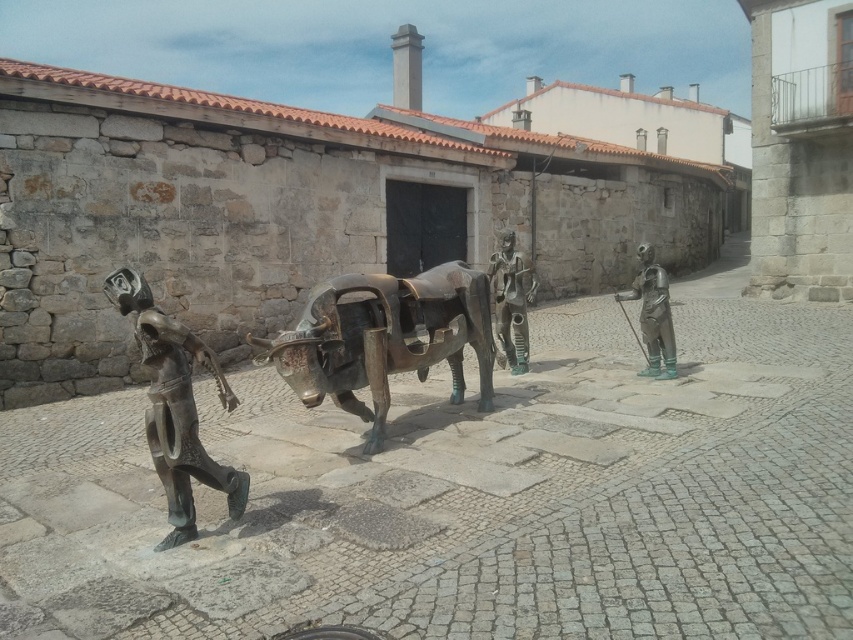
Question: Is bronze figure at left bigger than bronze statue at center?

Choices:
 (A) no
 (B) yes

Answer: (B)

Question: Which is farther from the green patina statue at right?

Choices:
 (A) bronze statue at center
 (B) bronze figure at left

Answer: (B)

Question: Is bronze statue at center further to the viewer compared to green patina statue at right?

Choices:
 (A) yes
 (B) no

Answer: (A)

Question: Where is bronze figure at left located in relation to bronze statue at center in the image?

Choices:
 (A) below
 (B) above

Answer: (A)

Question: Considering the real-world distances, which object is closest to the bronze figure at left?

Choices:
 (A) bronze statue at center
 (B) green patina statue at right

Answer: (A)

Question: Based on their relative distances, which object is farther from the bronze statue at center?

Choices:
 (A) green patina statue at right
 (B) bronze figure at left

Answer: (B)